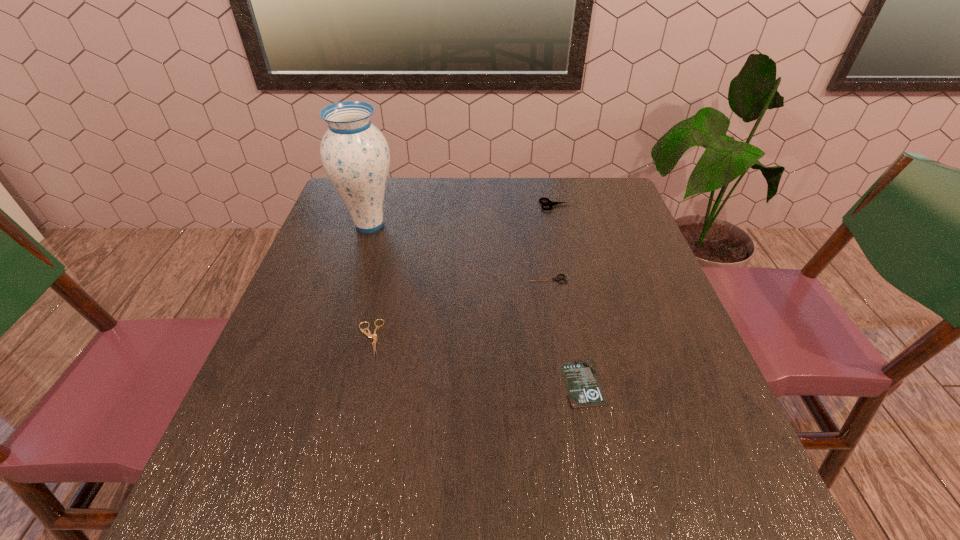
You are a GUI agent. You are given a task and a screenshot of the screen. Output one action in this format:
    pyautogui.click(x=<x>, y=<y>)
    Task: Click on the free space located 0.100m on the right of the third nearest object
    
    Given the screenshot: What is the action you would take?
    pyautogui.click(x=609, y=279)

Identify the location of free space located on the left of the nearest shears. This screenshot has height=540, width=960. (276, 338).

Image resolution: width=960 pixels, height=540 pixels. In order to click on vacant space located on the back of the shortest object in this screenshot , I will do `click(562, 277)`.

Locate an element on the screen. Image resolution: width=960 pixels, height=540 pixels. vase at the far edge is located at coordinates (355, 154).

At what (x,y) coordinates should I click in order to perform the action: click on shears at the far edge. Please return your answer as a coordinate pair (x, y). The height and width of the screenshot is (540, 960). Looking at the image, I should click on (550, 203).

The height and width of the screenshot is (540, 960). Find the location of `object that is positioned at the left edge`. object that is positioned at the left edge is located at coordinates (355, 154).

The height and width of the screenshot is (540, 960). What are the coordinates of `object positioned at the right edge` in the screenshot? It's located at (550, 203).

Where is `object present at the far left corner`? The image size is (960, 540). object present at the far left corner is located at coordinates (355, 154).

I want to click on object positioned at the far right corner, so click(x=550, y=203).

Find the location of a particular element. vacant space at the far edge of the desktop is located at coordinates (468, 202).